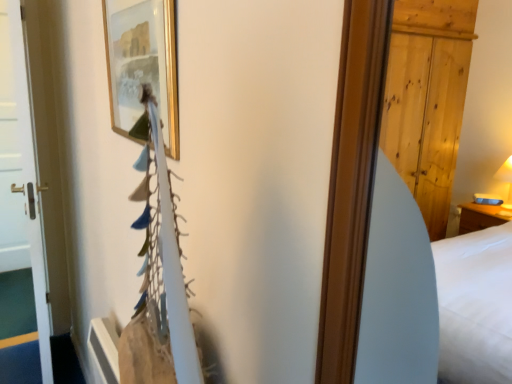
Question: Is gold/gilded picture frame at upper center further to camera compared to white glossy door at left?

Choices:
 (A) yes
 (B) no

Answer: (B)

Question: Is white glossy door at left located within gold/gilded picture frame at upper center?

Choices:
 (A) yes
 (B) no

Answer: (B)

Question: Can you confirm if gold/gilded picture frame at upper center is wider than white glossy door at left?

Choices:
 (A) no
 (B) yes

Answer: (A)

Question: Does gold/gilded picture frame at upper center touch white glossy door at left?

Choices:
 (A) yes
 (B) no

Answer: (B)

Question: Is gold/gilded picture frame at upper center positioned far away from white glossy door at left?

Choices:
 (A) no
 (B) yes

Answer: (B)

Question: Is gold/gilded picture frame at upper center outside of white glossy door at left?

Choices:
 (A) no
 (B) yes

Answer: (B)

Question: Considering the relative sizes of white glossy door at left and gold/gilded picture frame at upper center in the image provided, is white glossy door at left smaller than gold/gilded picture frame at upper center?

Choices:
 (A) no
 (B) yes

Answer: (A)

Question: Is white glossy door at left aimed at gold/gilded picture frame at upper center?

Choices:
 (A) yes
 (B) no

Answer: (B)

Question: Is gold/gilded picture frame at upper center completely or partially inside white glossy door at left?

Choices:
 (A) no
 (B) yes

Answer: (A)

Question: Can you confirm if white glossy door at left is positioned to the right of gold/gilded picture frame at upper center?

Choices:
 (A) yes
 (B) no

Answer: (B)

Question: Is white glossy door at left far away from gold/gilded picture frame at upper center?

Choices:
 (A) no
 (B) yes

Answer: (B)

Question: Considering the relative positions of white glossy door at left and gold/gilded picture frame at upper center in the image provided, is white glossy door at left behind gold/gilded picture frame at upper center?

Choices:
 (A) no
 (B) yes

Answer: (B)

Question: From a real-world perspective, relative to white glossy door at left, is gold/gilded picture frame at upper center vertically above or below?

Choices:
 (A) below
 (B) above

Answer: (B)